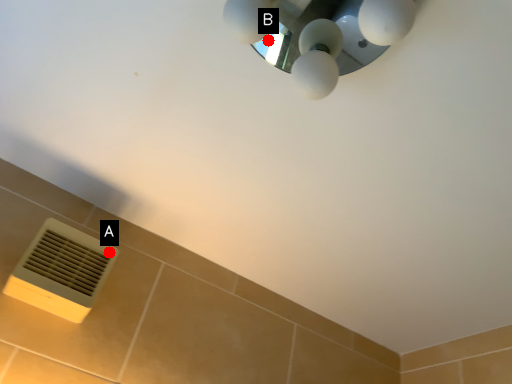
Question: Two points are circled on the image, labeled by A and B beside each circle. Which point is closer to the camera?

Choices:
 (A) A is closer
 (B) B is closer

Answer: (A)